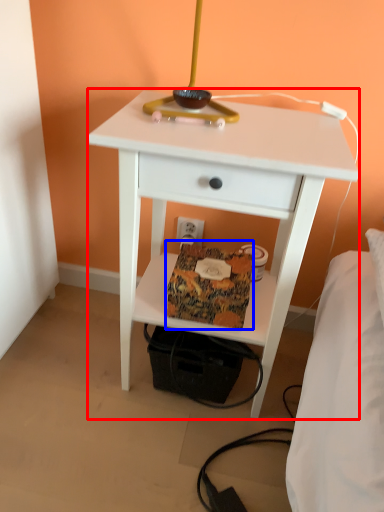
Question: Which object is further to the camera taking this photo, nightstand (highlighted by a red box) or package (highlighted by a blue box)?

Choices:
 (A) nightstand
 (B) package

Answer: (B)